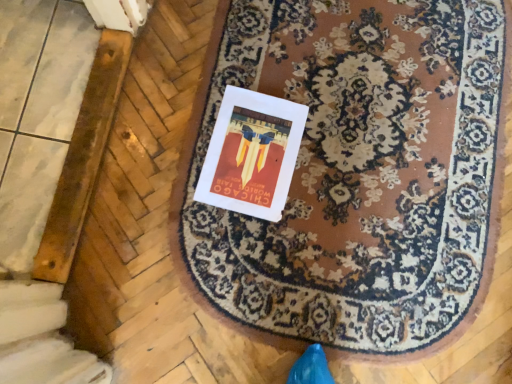
Question: Is brown woolen mat at center spatially inside white paper at center, or outside of it?

Choices:
 (A) inside
 (B) outside

Answer: (B)

Question: Looking at their shapes, would you say brown woolen mat at center is wider or thinner than white paper at center?

Choices:
 (A) thin
 (B) wide

Answer: (B)

Question: From a real-world perspective, is brown woolen mat at center physically located above or below white paper at center?

Choices:
 (A) below
 (B) above

Answer: (A)

Question: Looking at their shapes, would you say white paper at center is wider or thinner than brown woolen mat at center?

Choices:
 (A) wide
 (B) thin

Answer: (B)

Question: Is white paper at center taller or shorter than brown woolen mat at center?

Choices:
 (A) short
 (B) tall

Answer: (A)

Question: Considering the positions of point (223, 112) and point (371, 331), is point (223, 112) closer or farther from the camera than point (371, 331)?

Choices:
 (A) closer
 (B) farther

Answer: (B)

Question: Choose the correct answer: Is white paper at center inside brown woolen mat at center or outside it?

Choices:
 (A) outside
 (B) inside

Answer: (B)